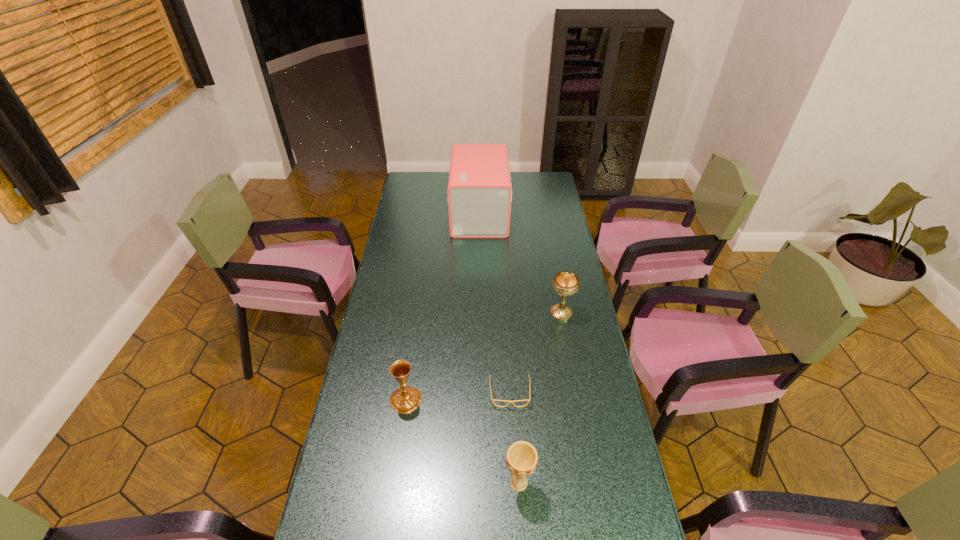
Locate which object ranks fourth in proximity to the box. Please provide its 2D coordinates. Your answer should be formatted as a tuple, i.e. [(x, y)], where the tuple contains the x and y coordinates of a point satisfying the conditions above.

[(521, 458)]

At what (x,y) coordinates should I click in order to perform the action: click on the second closest chalice to the rightmost object. Please return your answer as a coordinate pair (x, y). Image resolution: width=960 pixels, height=540 pixels. Looking at the image, I should click on (521, 458).

Select which chalice appears as the second closest to the second farthest chalice. Please provide its 2D coordinates. Your answer should be formatted as a tuple, i.e. [(x, y)], where the tuple contains the x and y coordinates of a point satisfying the conditions above.

[(565, 283)]

At what (x,y) coordinates should I click in order to perform the action: click on vacant space that satisfies the following two spatial constraints: 1. on the surface of the box where the text is embossed; 2. on the left side of the rightmost chalice. Please return your answer as a coordinate pair (x, y). This screenshot has width=960, height=540. Looking at the image, I should click on (480, 313).